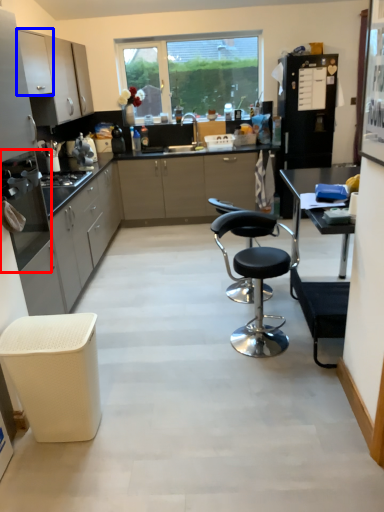
Question: Among these objects, which one is nearest to the camera, kitchen appliance (highlighted by a red box) or cabinetry (highlighted by a blue box)?

Choices:
 (A) kitchen appliance
 (B) cabinetry

Answer: (A)